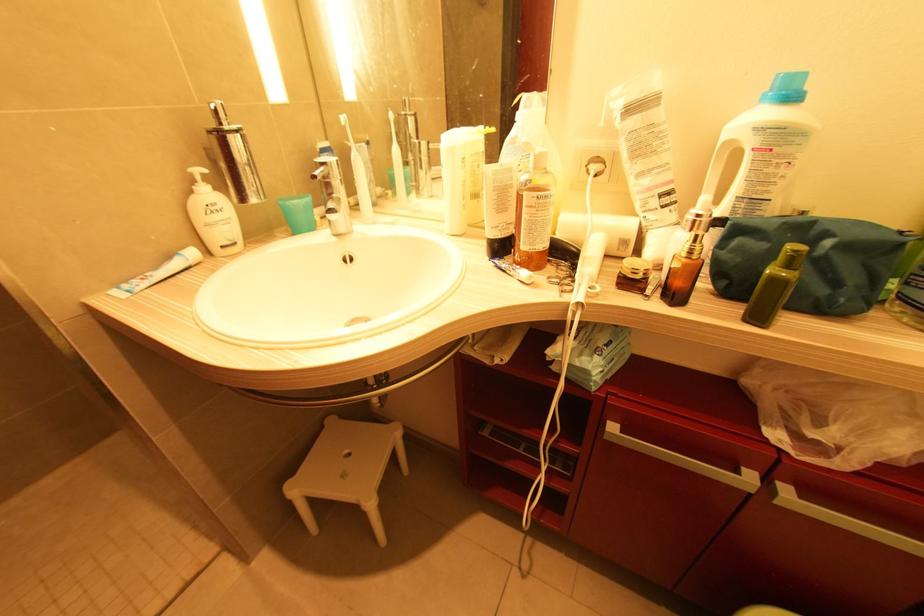
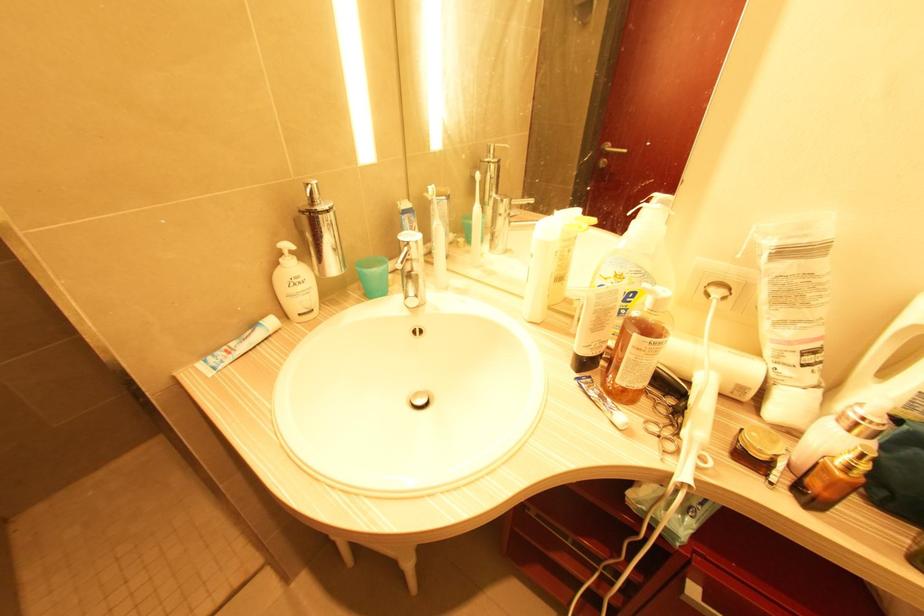
Find the pixel in the second image that matches the point at 568,290 in the first image.

(671, 448)